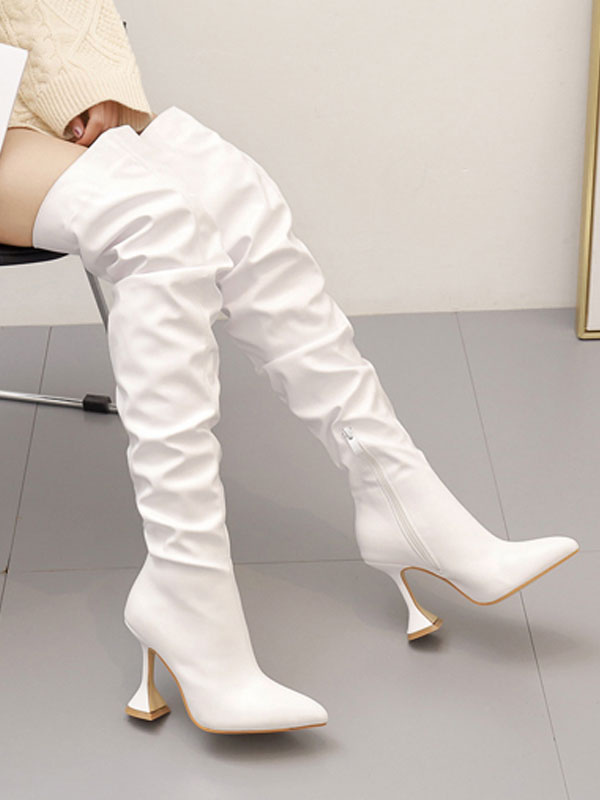
Where is `beige wall`? beige wall is located at coordinates click(400, 76).